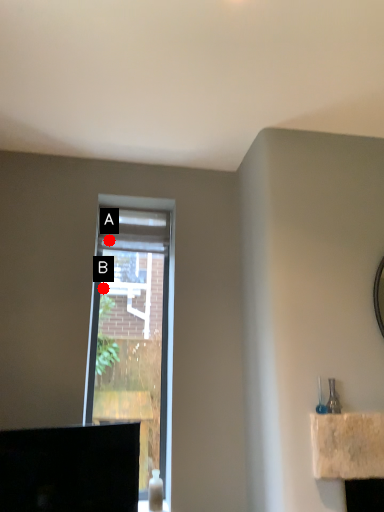
Question: Two points are circled on the image, labeled by A and B beside each circle. Which point is closer to the camera?

Choices:
 (A) A is closer
 (B) B is closer

Answer: (B)